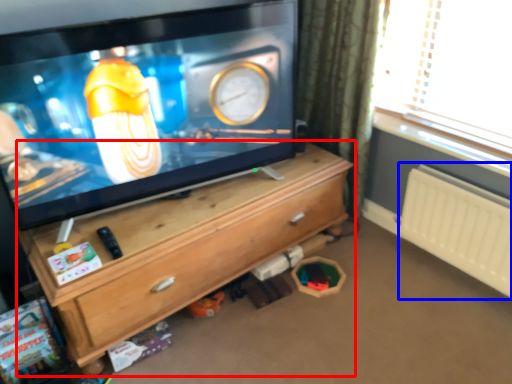
Question: Among these objects, which one is farthest to the camera, chest of drawers (highlighted by a red box) or radiator (highlighted by a blue box)?

Choices:
 (A) chest of drawers
 (B) radiator

Answer: (B)